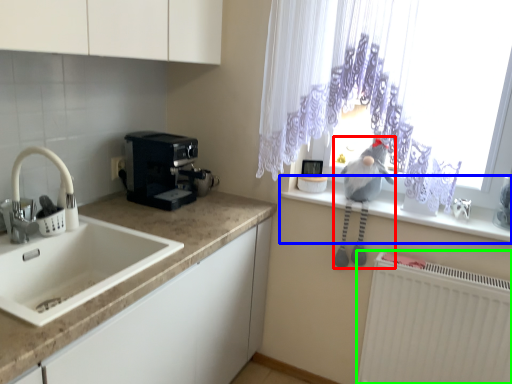
Question: Considering the real-world distances, which object is farthest from animal (highlighted by a red box)? window sill (highlighted by a blue box) or radiator (highlighted by a green box)?

Choices:
 (A) window sill
 (B) radiator

Answer: (B)